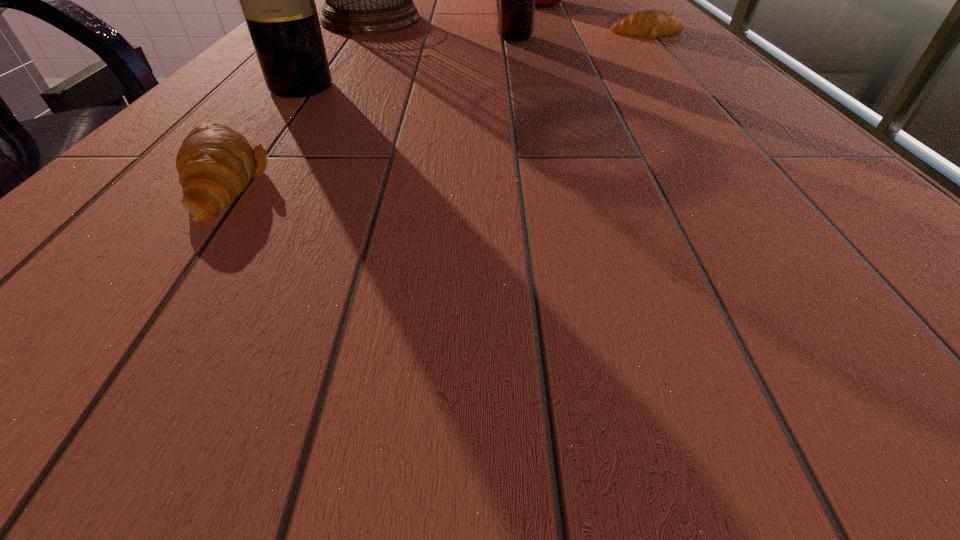
Please determine a free point for an extra crescent_roll to ensure balance. Please provide its 2D coordinates. Your answer should be formatted as a tuple, i.e. [(x, y)], where the tuple contains the x and y coordinates of a point satisfying the conditions above.

[(495, 87)]